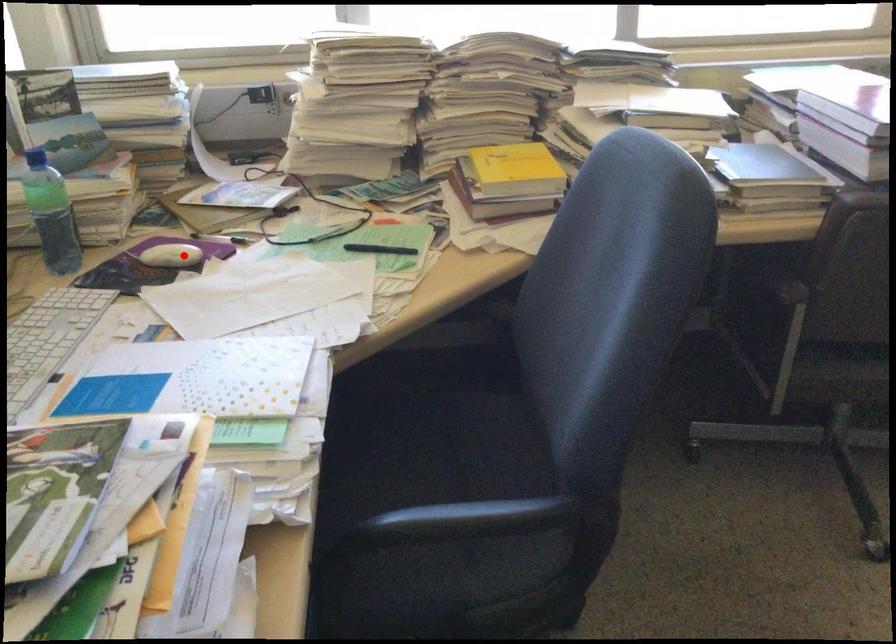
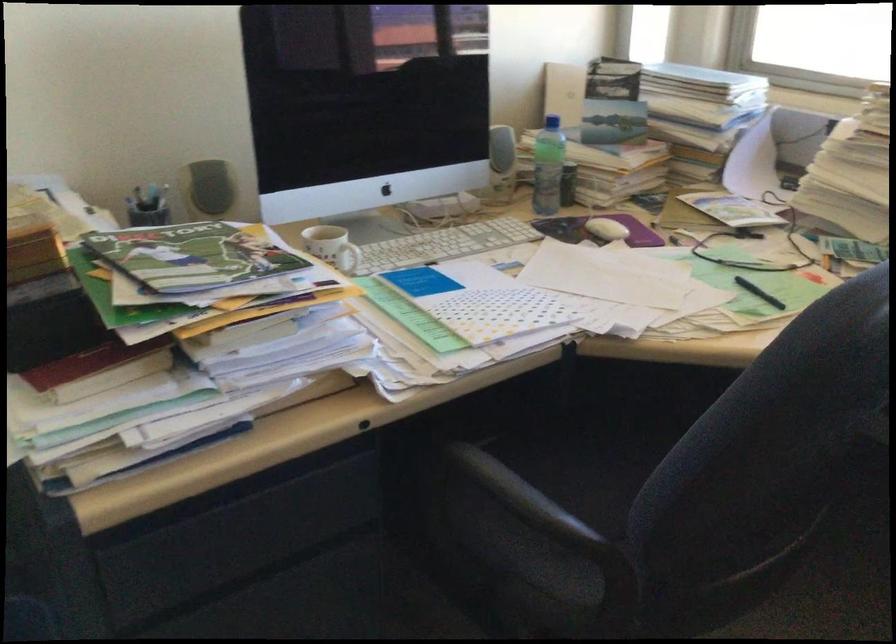
In the second image, find the point that corresponds to the highlighted location in the first image.

(606, 229)